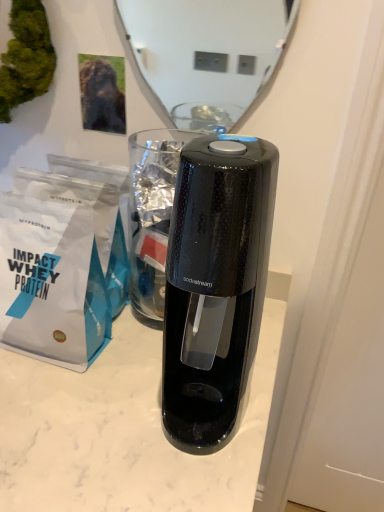
I want to click on green moss at upper left, so click(26, 57).

From a real-world perspective, which is physically below, green moss at upper left or glossy white mirror at upper center?

In real-world perspective, glossy white mirror at upper center is lower.

Considering the sizes of green moss at upper left and glossy white mirror at upper center in the image, is green moss at upper left wider or thinner than glossy white mirror at upper center?

Considering their sizes, green moss at upper left looks broader than glossy white mirror at upper center.

Where is `mirror located on the right of green moss at upper left`? The width and height of the screenshot is (384, 512). mirror located on the right of green moss at upper left is located at coordinates (207, 54).

Is glossy white mirror at upper center surrounded by green moss at upper left?

No.

Can you confirm if white matte paper bag at left is wider than green moss at upper left?

Indeed, white matte paper bag at left has a greater width compared to green moss at upper left.

From the picture: Between white matte paper bag at left and green moss at upper left, which one is positioned in front?

white matte paper bag at left is closer to the camera.

Does green moss at upper left turn towards white matte paper bag at left?

No, green moss at upper left is not aimed at white matte paper bag at left.

Can you see green moss at upper left touching white matte paper bag at left?

No.

Is green moss at upper left inside or outside of white matte paper bag at left?

green moss at upper left lies outside white matte paper bag at left.

In the image, is green moss at upper left positioned in front of or behind white matte paper bag at left?

In the image, green moss at upper left appears behind white matte paper bag at left.

Where is `mirror lying above the white matte paper bag at left (from the image's perspective)`? mirror lying above the white matte paper bag at left (from the image's perspective) is located at coordinates (207, 54).

From the picture: How far apart are white matte paper bag at left and glossy white mirror at upper center?

1.50 meters.

How many degrees apart are the facing directions of white matte paper bag at left and glossy white mirror at upper center?

The angular difference between white matte paper bag at left and glossy white mirror at upper center is 0.626 degrees.

From a real-world perspective, is white matte paper bag at left beneath glossy white mirror at upper center?

Yes, from a real-world perspective, white matte paper bag at left is below glossy white mirror at upper center.

Is glossy white mirror at upper center wider than white matte paper bag at left?

Incorrect, the width of glossy white mirror at upper center does not surpass that of white matte paper bag at left.

Considering the positions of objects glossy white mirror at upper center and white matte paper bag at left in the image provided, who is more to the left, glossy white mirror at upper center or white matte paper bag at left?

Positioned to the left is white matte paper bag at left.

Is point (251, 85) less distant than point (46, 338)?

No, (251, 85) is further to viewer.

Is glossy white mirror at upper center taller than green moss at upper left?

Indeed, glossy white mirror at upper center has a greater height compared to green moss at upper left.

This screenshot has width=384, height=512. Find the location of `plant to the left of glossy white mirror at upper center`. plant to the left of glossy white mirror at upper center is located at coordinates (26, 57).

Between glossy white mirror at upper center and green moss at upper left, which one is positioned behind?

green moss at upper left is further away from the camera.

Where is `mirror in front of the green moss at upper left`? The height and width of the screenshot is (512, 384). mirror in front of the green moss at upper left is located at coordinates (207, 54).

I want to click on paper bag located below the green moss at upper left (from the image's perspective), so click(x=62, y=262).

Considering their positions, is glossy white mirror at upper center positioned further to green moss at upper left than white matte paper bag at left?

glossy white mirror at upper center lies further to green moss at upper left than the other object.

Estimate the real-world distances between objects in this image. Which object is further from glossy white mirror at upper center, white matte paper bag at left or green moss at upper left?

white matte paper bag at left.

Looking at the image, which one is located closer to white matte paper bag at left, green moss at upper left or glossy white mirror at upper center?

green moss at upper left.

Which object lies further to the anchor point glossy white mirror at upper center, green moss at upper left or white matte paper bag at left?

white matte paper bag at left is further to glossy white mirror at upper center.

Estimate the real-world distances between objects in this image. Which object is further from green moss at upper left, white matte paper bag at left or glossy white mirror at upper center?

glossy white mirror at upper center lies further to green moss at upper left than the other object.

Which object lies nearer to the anchor point white matte paper bag at left, glossy white mirror at upper center or green moss at upper left?

green moss at upper left lies closer to white matte paper bag at left than the other object.

Where is `mirror that lies between green moss at upper left and white matte paper bag at left from top to bottom`? This screenshot has width=384, height=512. mirror that lies between green moss at upper left and white matte paper bag at left from top to bottom is located at coordinates (207, 54).